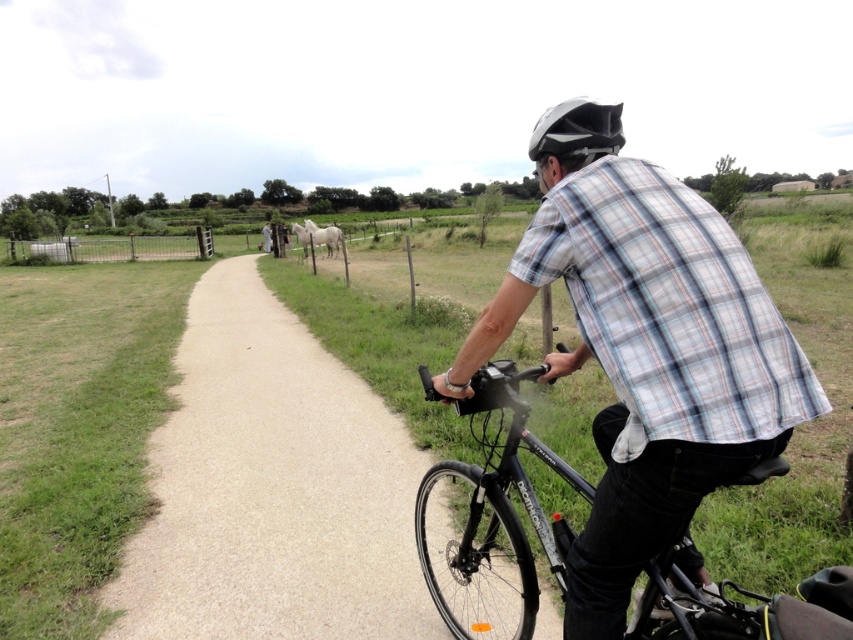
Between paved road at center and white matte bicycle helmet at upper center, which one appears on the left side from the viewer's perspective?

Positioned to the left is paved road at center.

Who is higher up, paved road at center or white matte bicycle helmet at upper center?

white matte bicycle helmet at upper center is above.

Between point (213, 390) and point (540, 164), which one is positioned in front?

Point (540, 164)

I want to click on paved road at center, so click(271, 488).

Who is shorter, black matte bicycle at center or white matte bicycle helmet at upper center?

black matte bicycle at center is shorter.

Is point (492, 401) farther from camera compared to point (608, 104)?

Yes, it is.

Does point (456, 577) lie behind point (575, 154)?

Yes, point (456, 577) is farther from viewer.

Where is `black matte bicycle at center`? The image size is (853, 640). black matte bicycle at center is located at coordinates (497, 513).

Does white matte bicycle helmet at upper center appear over metallic wire fence at left?

Actually, white matte bicycle helmet at upper center is below metallic wire fence at left.

The width and height of the screenshot is (853, 640). I want to click on white matte bicycle helmet at upper center, so click(x=573, y=134).